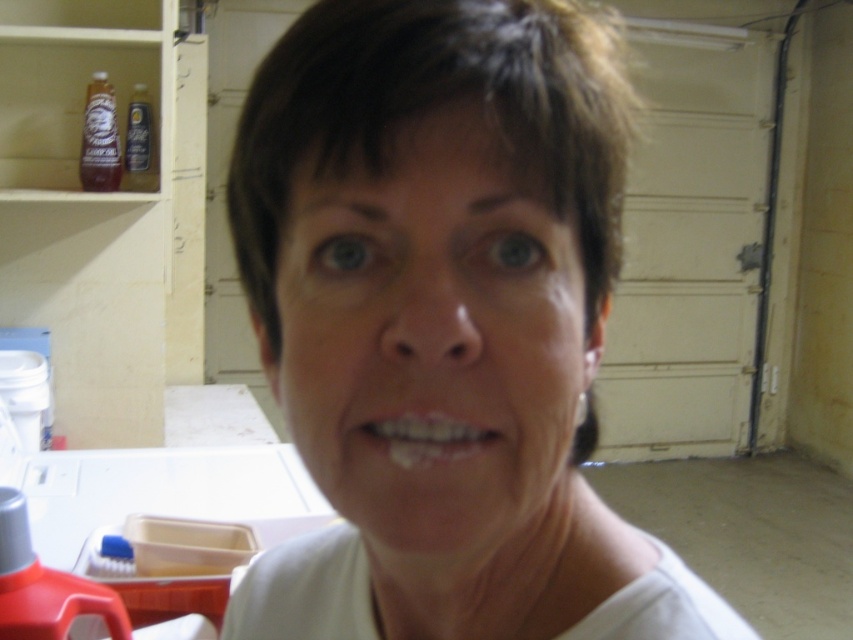
Who is lower down, white matte shirt at center or white glossy teeth at center?

Positioned lower is white matte shirt at center.

Identify the location of white matte shirt at center. (444, 323).

Identify the location of white matte shirt at center. This screenshot has width=853, height=640. (444, 323).